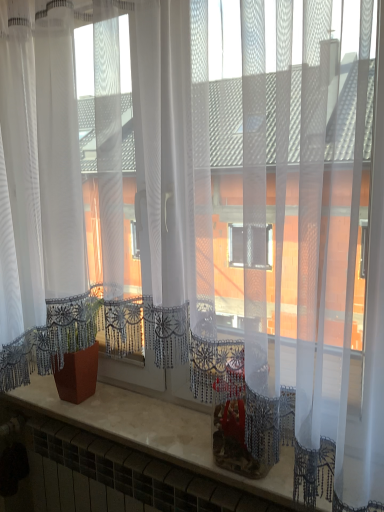
The height and width of the screenshot is (512, 384). Find the location of `free space to the left of matte terracotta pot at lower left`. free space to the left of matte terracotta pot at lower left is located at coordinates (39, 396).